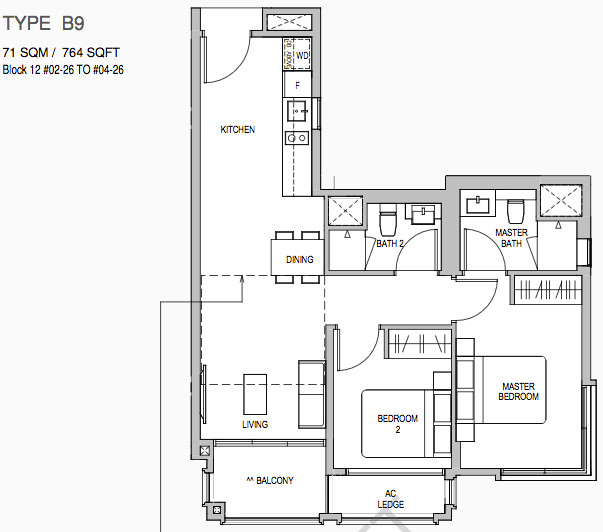
This screenshot has height=532, width=603. What are the coordinates of `kitchen` in the screenshot? It's located at (242, 130).